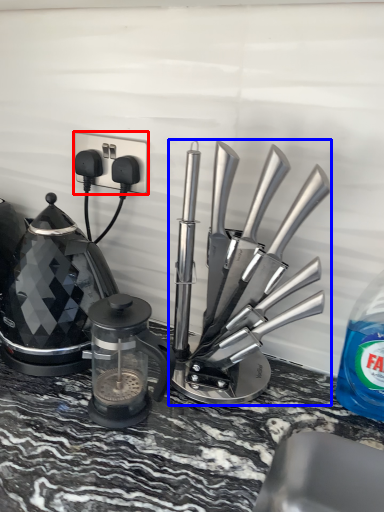
Question: Which object appears farthest to the camera in this image, electric outlet (highlighted by a red box) or kitchen appliance (highlighted by a blue box)?

Choices:
 (A) electric outlet
 (B) kitchen appliance

Answer: (A)